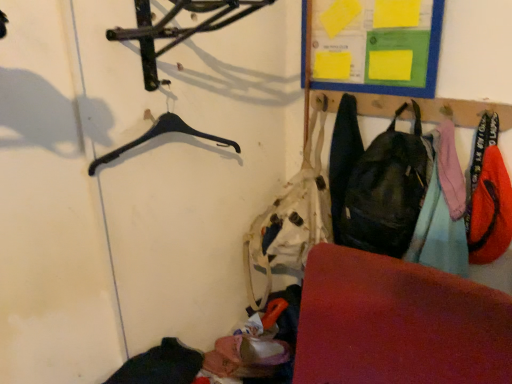
Question: Is orange fabric pants at right, the second clothing positioned from the right, bigger or smaller than black plastic hanger at upper left?

Choices:
 (A) small
 (B) big

Answer: (A)

Question: From a real-world perspective, is orange fabric pants at right, the second clothing positioned from the left, positioned above or below black plastic hanger at upper left?

Choices:
 (A) below
 (B) above

Answer: (A)

Question: Based on their relative distances, which object is farther from the yellow paper at upper right?

Choices:
 (A) rubberized red mat at lower right
 (B) matte black backpack at right
 (C) matte black backpack at center-right, which is counted as the 1th clothing, starting from the left
 (D) black plastic hanger at upper left
 (E) orange fabric bag at right, marked as the first clothing in a right-to-left arrangement

Answer: (A)

Question: Estimate the real-world distances between objects in this image. Which object is farther from the orange fabric bag at right, marked as the third clothing in a left-to-right arrangement?

Choices:
 (A) matte black backpack at right
 (B) rubberized red mat at lower right
 (C) yellow paper at upper right
 (D) orange fabric pants at right, the second clothing positioned from the left
 (E) matte black backpack at center-right, which is counted as the 1th clothing, starting from the left

Answer: (B)